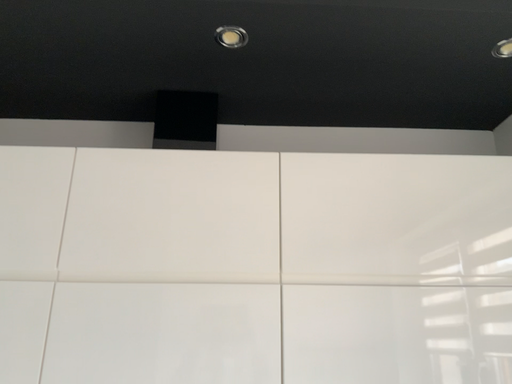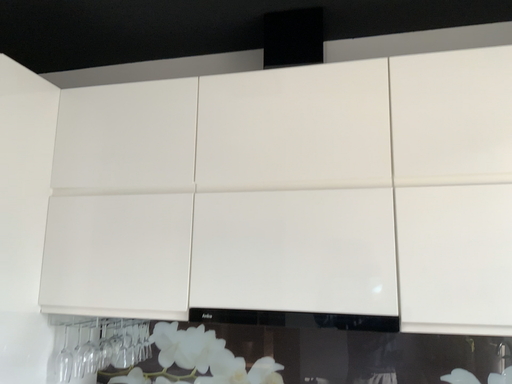
Question: How did the camera likely rotate when shooting the video?

Choices:
 (A) rotated downward
 (B) rotated upward

Answer: (A)